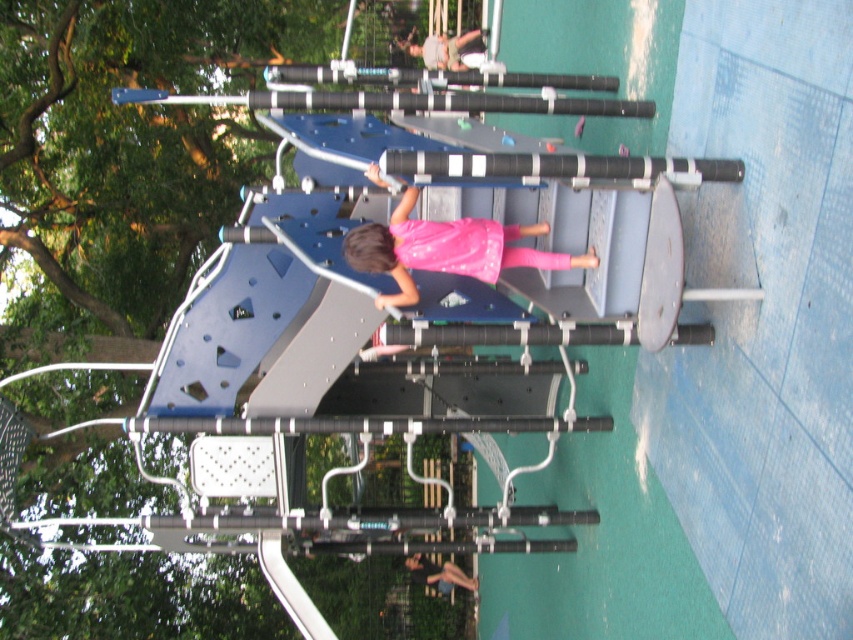
You are a parent observing your child at the playground. You notice two dresses at the center of the image. Which one is taller, the pink matte dress at center or the pink fabric dress at center?

The pink matte dress at center is taller than the pink fabric dress at center.

You are a parent supervising children at the playground. You notice two dresses at the center of the playground equipment. Which dress is positioned lower between the pink matte dress at center and the pink fabric dress at center?

The pink matte dress at center is located below the pink fabric dress at center, so the pink matte dress at center is positioned lower.

You are a parent trying to choose between two dresses for your child to wear to the playground. The pink matte dress at center and the pink fabric dress at center are both available. If you want your child to have more space to move while climbing the playground equipment, which dress should you choose?

The pink matte dress at center has a larger width than the pink fabric dress at center, so it provides more space to move while climbing the playground equipment.